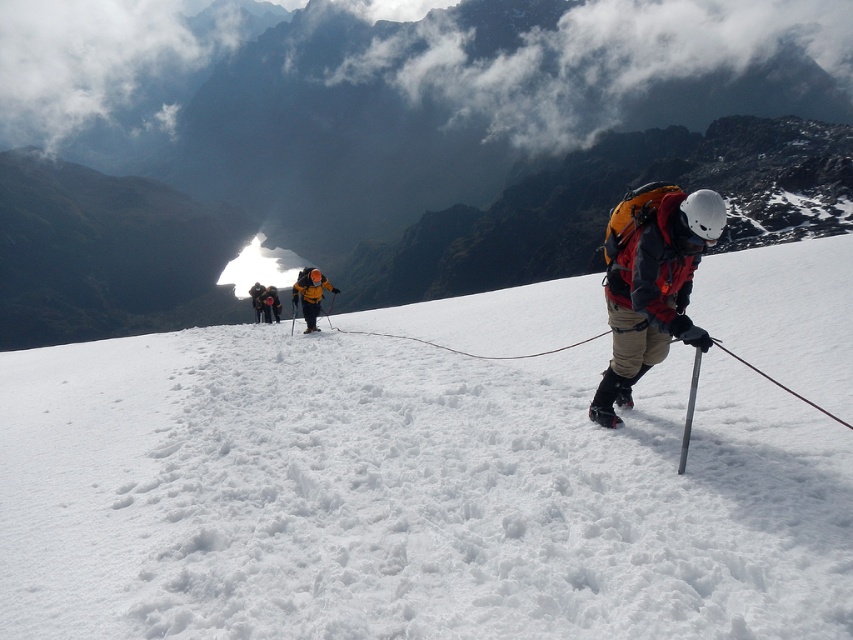
Who is lower down, white fluffy snow at center or yellow matte ski at center?

yellow matte ski at center

Does white fluffy snow at center appear on the left side of yellow matte ski at center?

No, white fluffy snow at center is not to the left of yellow matte ski at center.

Who is more distant from viewer, (x=86, y=492) or (x=308, y=328)?

The point (x=308, y=328) is more distant.

The height and width of the screenshot is (640, 853). I want to click on white fluffy snow at center, so click(407, 493).

Is point (308, 321) positioned in front of point (314, 328)?

No, it is not.

Between orange fabric jacket at center and yellow matte ski at center, which one has less height?

With less height is yellow matte ski at center.

What do you see at coordinates (310, 294) in the screenshot?
I see `orange fabric jacket at center` at bounding box center [310, 294].

Locate an element on the screen. Image resolution: width=853 pixels, height=640 pixels. orange fabric jacket at center is located at coordinates (310, 294).

Which is behind, point (57, 538) or point (263, 307)?

The point (263, 307) is behind.

Identify the location of white fluffy snow at center. The height and width of the screenshot is (640, 853). (407, 493).